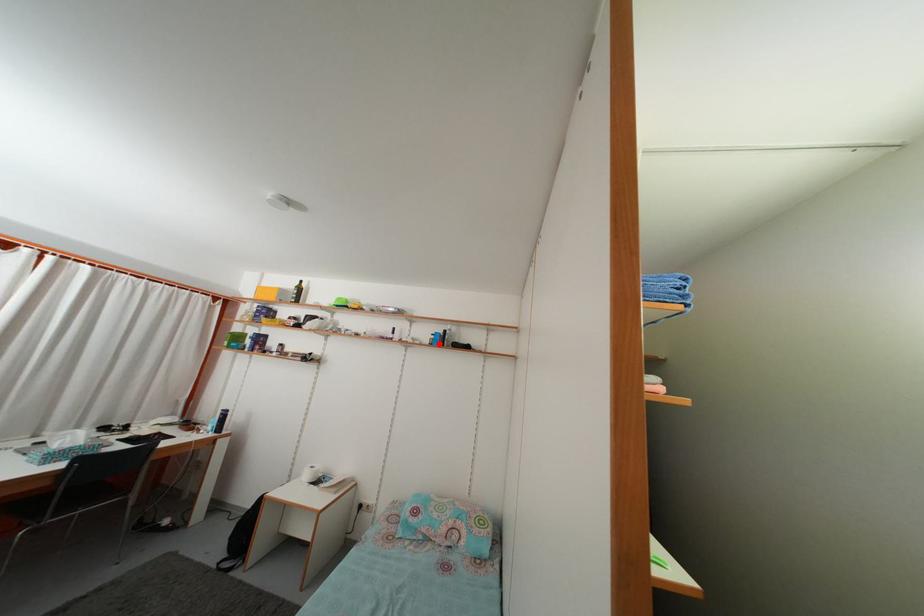
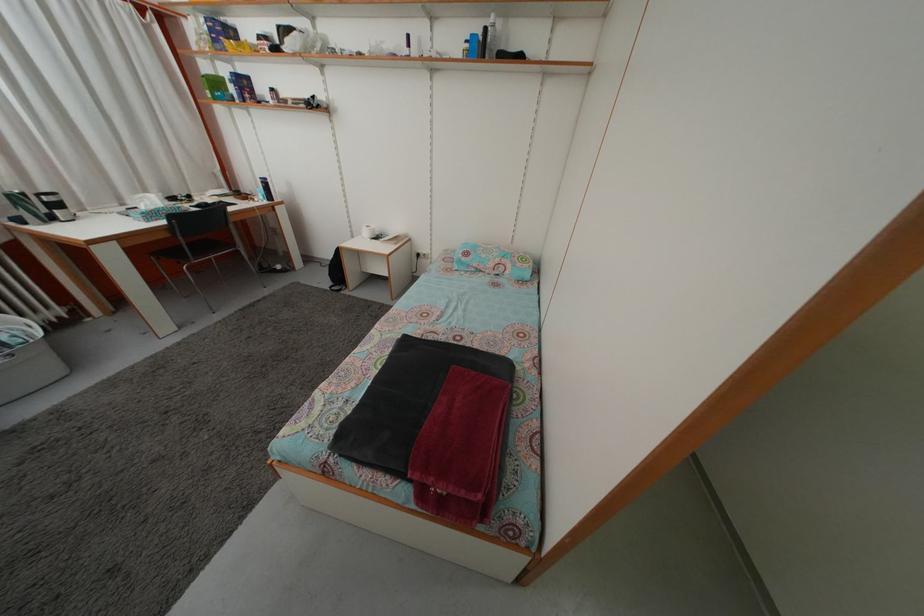
Where in the second image is the point corresponding to the highlighted location from the first image?

(473, 53)